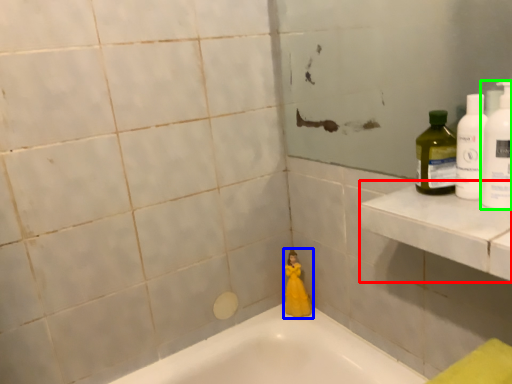
Question: Considering the real-world distances, which object is farthest from ledge (highlighted by a red box)? toy (highlighted by a blue box) or cleaning product (highlighted by a green box)?

Choices:
 (A) toy
 (B) cleaning product

Answer: (A)